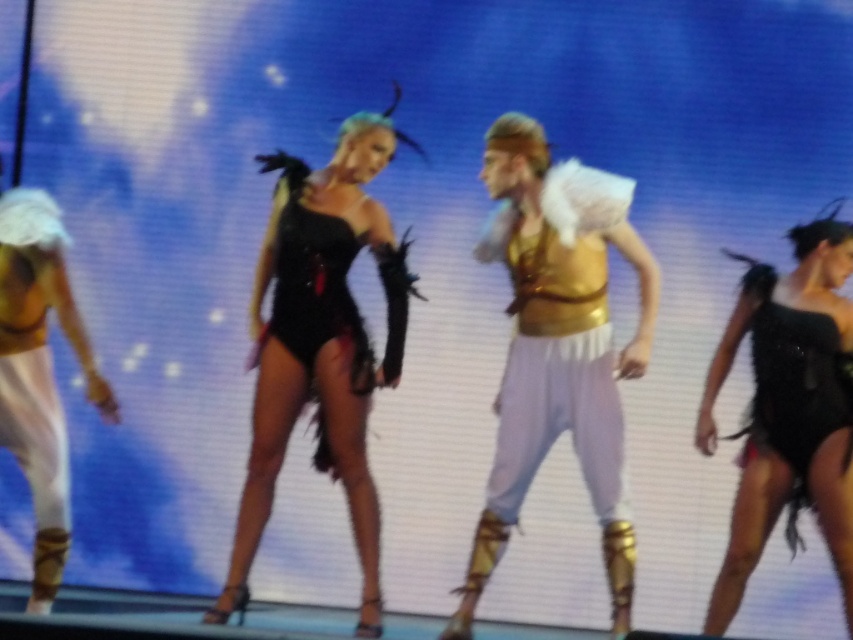
This screenshot has width=853, height=640. What do you see at coordinates (788, 406) in the screenshot?
I see `shiny black dress at right` at bounding box center [788, 406].

Is point (805, 241) more distant than point (4, 296)?

Yes, it is behind point (4, 296).

Find the location of a particular element. The image size is (853, 640). shiny black dress at right is located at coordinates (788, 406).

Does gold metallic vest at center appear on the left side of shiny black dress at right?

Indeed, gold metallic vest at center is positioned on the left side of shiny black dress at right.

Who is more forward, (595, 369) or (828, 237)?

Point (595, 369) is in front.

The width and height of the screenshot is (853, 640). Find the location of `gold metallic vest at center`. gold metallic vest at center is located at coordinates (556, 346).

Locate an element on the screen. gold metallic vest at center is located at coordinates (556, 346).

From the picture: Is gold metallic vest at center thinner than black sequined bodysuit at center?

Yes.

At what (x,y) coordinates should I click in order to perform the action: click on gold metallic vest at center. Please return your answer as a coordinate pair (x, y). Looking at the image, I should click on (556, 346).

Where is `gold metallic vest at center`? The width and height of the screenshot is (853, 640). gold metallic vest at center is located at coordinates (556, 346).